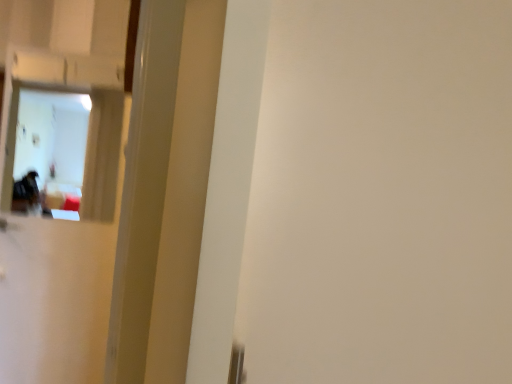
Describe the element at coordinates (62, 186) in the screenshot. Image resolution: width=512 pixels, height=384 pixels. I see `transparent glass screen door at upper left` at that location.

Locate an element on the screen. This screenshot has width=512, height=384. transparent glass screen door at upper left is located at coordinates (62, 186).

Locate an element on the screen. transparent glass screen door at upper left is located at coordinates (62, 186).